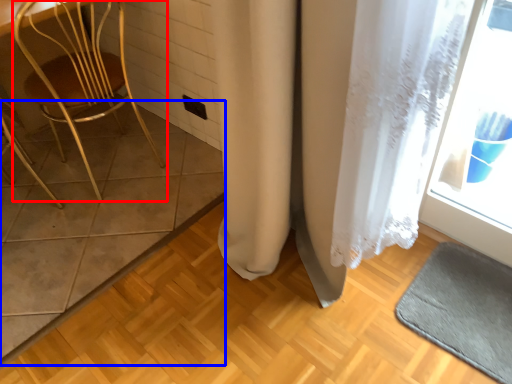
Question: Among these objects, which one is nearest to the camera, chair (highlighted by a red box) or tile (highlighted by a blue box)?

Choices:
 (A) chair
 (B) tile

Answer: (A)